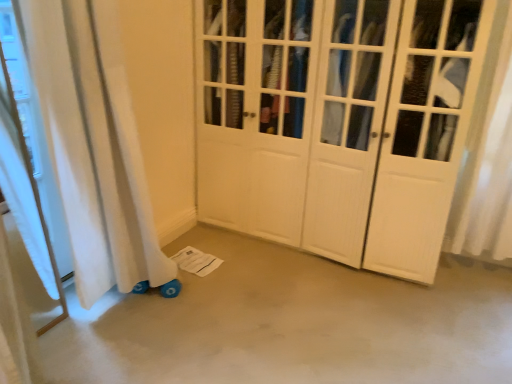
What do you see at coordinates (290, 324) in the screenshot? I see `smooth concrete floor at lower center` at bounding box center [290, 324].

Where is `smooth concrete floor at lower center`? smooth concrete floor at lower center is located at coordinates tap(290, 324).

I want to click on white wood wardrobe at center, so click(x=337, y=123).

In order to face white wood wardrobe at center, should I rotate leftwards or rightwards?

To align with it, rotate right about 10.093°.

This screenshot has width=512, height=384. What do you see at coordinates (337, 123) in the screenshot?
I see `white wood wardrobe at center` at bounding box center [337, 123].

Locate an element on the screen. The image size is (512, 384). smooth concrete floor at lower center is located at coordinates tap(290, 324).

Which is more to the right, smooth concrete floor at lower center or white wood wardrobe at center?

white wood wardrobe at center.

Which object is further away from the camera, smooth concrete floor at lower center or white wood wardrobe at center?

white wood wardrobe at center is further away from the camera.

Between point (296, 271) and point (204, 75), which one is positioned behind?

The point (204, 75) is farther.

From the image's perspective, is smooth concrete floor at lower center under white wood wardrobe at center?

Yes, from the image's perspective, smooth concrete floor at lower center is below white wood wardrobe at center.

From a real-world perspective, between smooth concrete floor at lower center and white wood wardrobe at center, who is vertically lower?

smooth concrete floor at lower center, from a real-world perspective.

Considering the sizes of objects smooth concrete floor at lower center and white wood wardrobe at center in the image provided, who is thinner, smooth concrete floor at lower center or white wood wardrobe at center?

Thinner between the two is white wood wardrobe at center.

Is smooth concrete floor at lower center shorter than white wood wardrobe at center?

Yes.

Can you confirm if smooth concrete floor at lower center is smaller than white wood wardrobe at center?

Correct, smooth concrete floor at lower center occupies less space than white wood wardrobe at center.

In the scene shown: Is white wood wardrobe at center a part of smooth concrete floor at lower center?

Definitely not — white wood wardrobe at center is not inside smooth concrete floor at lower center.

Are smooth concrete floor at lower center and white wood wardrobe at center far apart?

smooth concrete floor at lower center is near white wood wardrobe at center, not far away.

Is smooth concrete floor at lower center turned away from white wood wardrobe at center?

No.

Based on the photo, what's the angular difference between smooth concrete floor at lower center and white wood wardrobe at center's facing directions?

The angular difference between smooth concrete floor at lower center and white wood wardrobe at center is 1.16 degrees.

Measure the distance from smooth concrete floor at lower center to white wood wardrobe at center.

smooth concrete floor at lower center and white wood wardrobe at center are 29.67 inches apart.

Locate an element on the screen. Image resolution: width=512 pixels, height=384 pixels. door to the right of smooth concrete floor at lower center is located at coordinates (337, 123).

Which is more to the right, white wood wardrobe at center or smooth concrete floor at lower center?

white wood wardrobe at center.

Relative to smooth concrete floor at lower center, is white wood wardrobe at center in front or behind?

Visually, white wood wardrobe at center is located behind smooth concrete floor at lower center.

Is point (279, 27) positioned after point (318, 362)?

Yes, point (279, 27) is farther from viewer.

From the image's perspective, is white wood wardrobe at center under smooth concrete floor at lower center?

Incorrect, from the image's perspective, white wood wardrobe at center is higher than smooth concrete floor at lower center.

From a real-world perspective, which is physically below, white wood wardrobe at center or smooth concrete floor at lower center?

From a 3D spatial view, smooth concrete floor at lower center is below.

Is white wood wardrobe at center wider or thinner than smooth concrete floor at lower center?

white wood wardrobe at center is thinner than smooth concrete floor at lower center.

Considering the sizes of white wood wardrobe at center and smooth concrete floor at lower center in the image, is white wood wardrobe at center taller or shorter than smooth concrete floor at lower center?

In the image, white wood wardrobe at center appears to be taller than smooth concrete floor at lower center.

Considering the sizes of objects white wood wardrobe at center and smooth concrete floor at lower center in the image provided, who is bigger, white wood wardrobe at center or smooth concrete floor at lower center?

Bigger between the two is white wood wardrobe at center.

Can we say white wood wardrobe at center lies outside smooth concrete floor at lower center?

Absolutely, white wood wardrobe at center is external to smooth concrete floor at lower center.

Is white wood wardrobe at center positioned far away from smooth concrete floor at lower center?

Actually, white wood wardrobe at center and smooth concrete floor at lower center are a little close together.

Could you tell me if white wood wardrobe at center is turned towards smooth concrete floor at lower center?

Yes.

Where is `concrete below the white wood wardrobe at center (from a real-world perspective)`? The image size is (512, 384). concrete below the white wood wardrobe at center (from a real-world perspective) is located at coordinates (290, 324).

Identify the location of door on the right of smooth concrete floor at lower center. (337, 123).

You are a GUI agent. You are given a task and a screenshot of the screen. Output one action in this format:
    pyautogui.click(x=<x>, y=<y>)
    Task: Click on the concrete in front of the white wood wardrobe at center
    
    Given the screenshot: What is the action you would take?
    pyautogui.click(x=290, y=324)